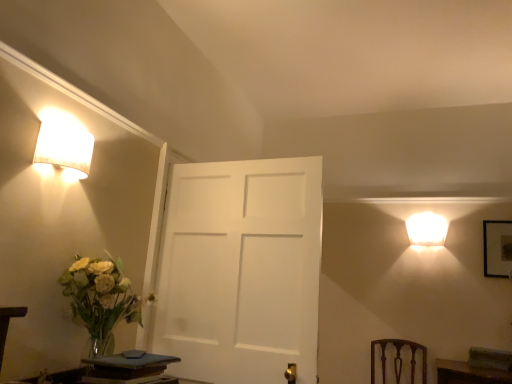
Question: Considering the relative sizes of wooden table at lower left, which is the first table in front-to-back order, and matte white lampshade at upper left, the 2th lamp viewed from the right, in the image provided, is wooden table at lower left, which is the first table in front-to-back order, smaller than matte white lampshade at upper left, the 2th lamp viewed from the right,?

Choices:
 (A) yes
 (B) no

Answer: (A)

Question: Is wooden table at lower left, the 2th table positioned from the right, shorter than matte white lampshade at upper left, positioned as the 1th lamp in front-to-back order?

Choices:
 (A) no
 (B) yes

Answer: (A)

Question: Would you say wooden table at lower left, the 2th table positioned from the right, contains matte white lampshade at upper left, positioned as the 1th lamp in front-to-back order?

Choices:
 (A) yes
 (B) no

Answer: (B)

Question: Is wooden table at lower left, the 2th table positioned from the right, not inside matte white lampshade at upper left, which appears as the second lamp when viewed from the back?

Choices:
 (A) yes
 (B) no

Answer: (A)

Question: Is wooden table at lower left, positioned as the first table in left-to-right order, wider than matte white lampshade at upper left, which appears as the 1th lamp when viewed from the top?

Choices:
 (A) no
 (B) yes

Answer: (A)

Question: From the image's perspective, is brown wood chair at lower right located above or below wooden table at lower left, marked as the 2th table in a back-to-front arrangement?

Choices:
 (A) above
 (B) below

Answer: (B)

Question: In the image, is brown wood chair at lower right positioned in front of or behind wooden table at lower left, the 2th table positioned from the right?

Choices:
 (A) front
 (B) behind

Answer: (B)

Question: Do you think brown wood chair at lower right is within wooden table at lower left, which is the first table in front-to-back order, or outside of it?

Choices:
 (A) outside
 (B) inside

Answer: (A)

Question: Visually, is brown wood chair at lower right positioned to the left or to the right of wooden table at lower left, marked as the 2th table in a back-to-front arrangement?

Choices:
 (A) right
 (B) left

Answer: (A)

Question: Looking at their shapes, would you say translucent glass vase at left is wider or thinner than white matte lampshade at upper right, the second lamp in the front-to-back sequence?

Choices:
 (A) wide
 (B) thin

Answer: (A)

Question: Is translucent glass vase at left bigger or smaller than white matte lampshade at upper right, placed as the 2th lamp when sorted from left to right?

Choices:
 (A) small
 (B) big

Answer: (B)

Question: Is translucent glass vase at left taller or shorter than white matte lampshade at upper right, the second lamp in the front-to-back sequence?

Choices:
 (A) short
 (B) tall

Answer: (B)

Question: Is point (86, 314) positioned closer to the camera than point (426, 243)?

Choices:
 (A) closer
 (B) farther

Answer: (A)

Question: From the image's perspective, is translucent glass vase at left above or below wooden table at lower left, the 2th table positioned from the right?

Choices:
 (A) above
 (B) below

Answer: (A)

Question: Based on their sizes in the image, would you say translucent glass vase at left is bigger or smaller than wooden table at lower left, which is the first table in front-to-back order?

Choices:
 (A) small
 (B) big

Answer: (B)